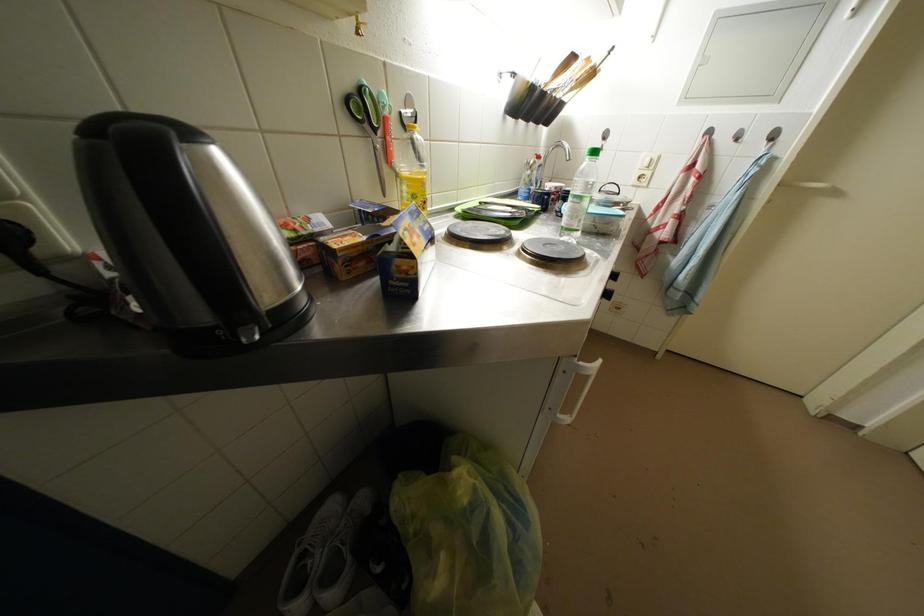
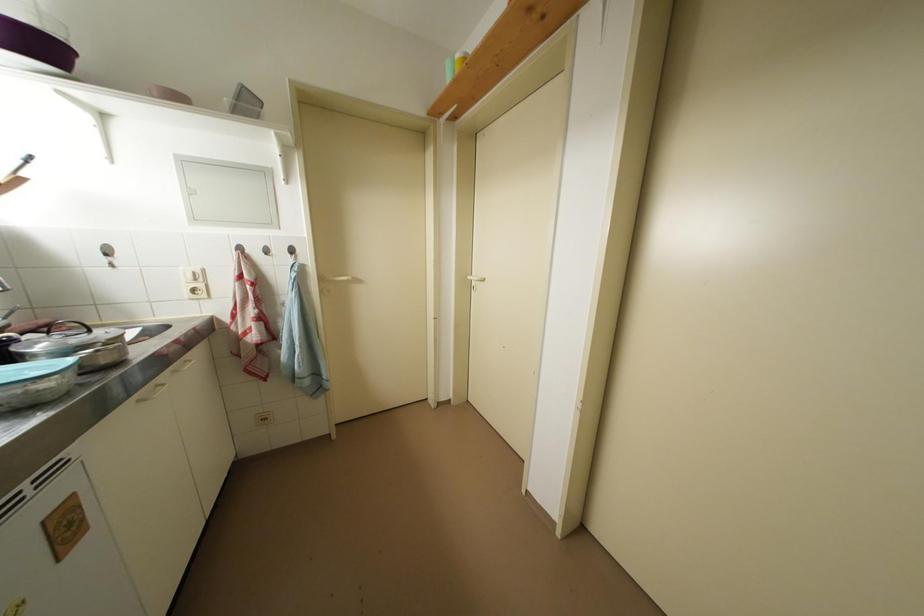
Question: The camera is either moving clockwise (left) or counter-clockwise (right) around the object. The first image is from the beginning of the video and the second image is from the end. Is the camera moving left or right when shooting the video?

Choices:
 (A) Left
 (B) Right

Answer: (A)